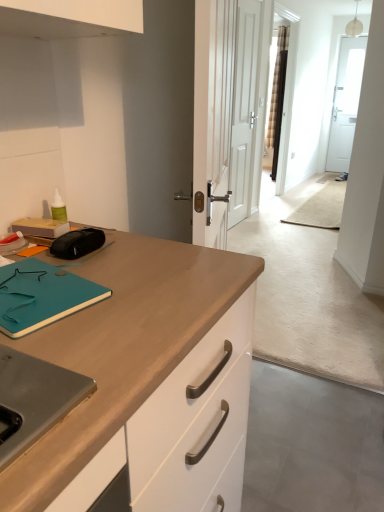
Question: Considering the positions of white matte door at center and teal matte notepad at left in the image, is white matte door at center bigger or smaller than teal matte notepad at left?

Choices:
 (A) small
 (B) big

Answer: (B)

Question: Considering the positions of point (243, 148) and point (39, 279), is point (243, 148) closer or farther from the camera than point (39, 279)?

Choices:
 (A) farther
 (B) closer

Answer: (A)

Question: From the image's perspective, is white matte door at center above or below teal matte notepad at left?

Choices:
 (A) below
 (B) above

Answer: (B)

Question: In the image, is teal matte notepad at left on the left side or the right side of white matte door at center?

Choices:
 (A) left
 (B) right

Answer: (A)

Question: Is teal matte notepad at left taller or shorter than white matte door at center?

Choices:
 (A) tall
 (B) short

Answer: (B)

Question: Based on their sizes in the image, would you say teal matte notepad at left is bigger or smaller than white matte door at center?

Choices:
 (A) big
 (B) small

Answer: (B)

Question: Is teal matte notepad at left inside or outside of white matte door at center?

Choices:
 (A) outside
 (B) inside

Answer: (A)